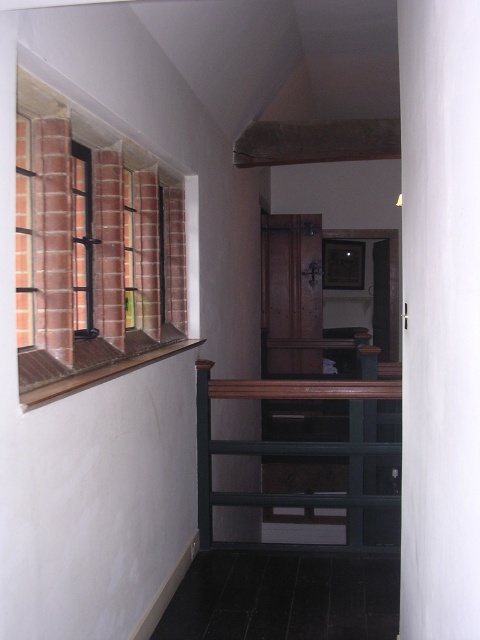
Question: Which object is the farthest from the brick textured window at left?

Choices:
 (A) dark green painted wood at center
 (B) brick textured window at upper left

Answer: (A)

Question: Is brick textured window at upper left bigger than dark green painted wood at center?

Choices:
 (A) yes
 (B) no

Answer: (B)

Question: Which of the following is the farthest from the observer?

Choices:
 (A) (80, 307)
 (B) (24, 252)
 (C) (386, 448)

Answer: (C)

Question: Is brick textured window at upper left to the left of brick textured window at left from the viewer's perspective?

Choices:
 (A) yes
 (B) no

Answer: (B)

Question: Which point is farther to the camera?

Choices:
 (A) (127, 294)
 (B) (90, 275)

Answer: (A)

Question: Can you confirm if brick textured window at upper left is bigger than dark green painted wood at center?

Choices:
 (A) no
 (B) yes

Answer: (A)